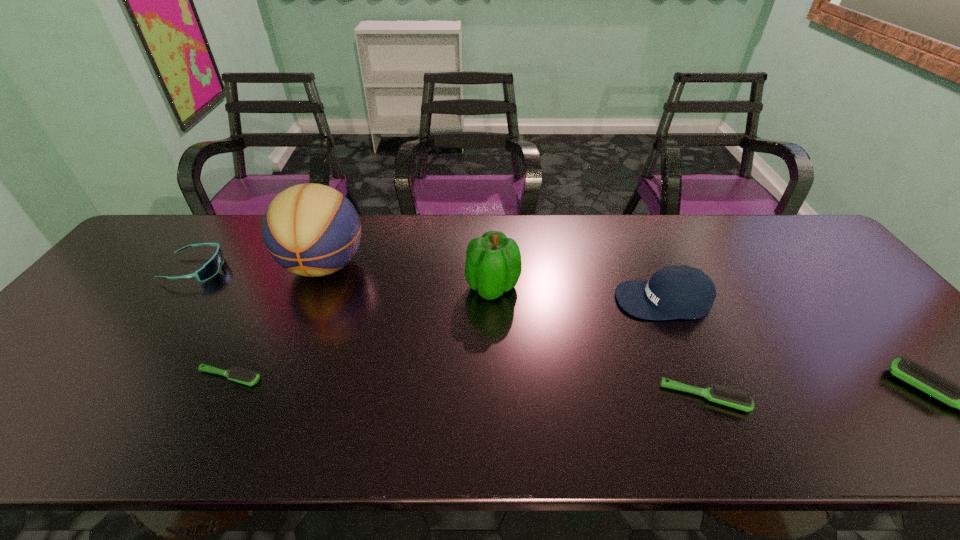
Find the location of a particular element. The image size is (960, 540). vacant position in the image that satisfies the following two spatial constraints: 1. on the patterned surface of the second shortest object; 2. on the left side of the tallest object is located at coordinates (272, 397).

The height and width of the screenshot is (540, 960). I want to click on vacant region that satisfies the following two spatial constraints: 1. on the back side of the second tallest hairbrush; 2. on the front-facing side of the leftmost object, so click(649, 269).